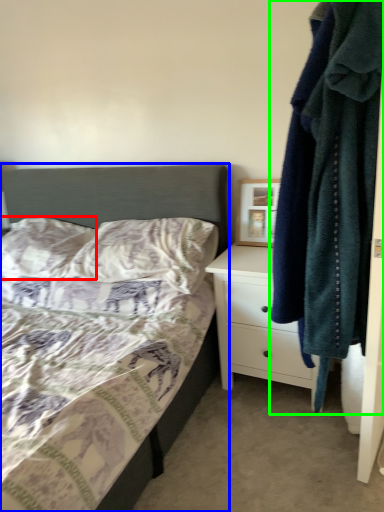
Question: Estimate the real-world distances between objects in this image. Which object is closer to pillow (highlighted by a red box), bed (highlighted by a blue box) or laundry (highlighted by a green box)?

Choices:
 (A) bed
 (B) laundry

Answer: (A)